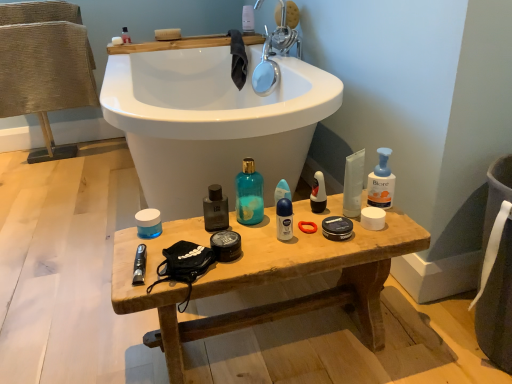
Question: Does teal glass bottle at center, which is the 1th cleaning product from left to right, have a greater width compared to blue matte deodorant stick at center, arranged as the 6th toiletry when viewed from the left?

Choices:
 (A) yes
 (B) no

Answer: (A)

Question: From the image's perspective, is teal glass bottle at center, which is the 1th cleaning product from left to right, below blue matte deodorant stick at center, which is the second toiletry in right-to-left order?

Choices:
 (A) yes
 (B) no

Answer: (B)

Question: Considering the relative positions of teal glass bottle at center, arranged as the third cleaning product when viewed from the right, and blue matte deodorant stick at center, arranged as the 6th toiletry when viewed from the left, in the image provided, is teal glass bottle at center, arranged as the third cleaning product when viewed from the right, to the right of blue matte deodorant stick at center, arranged as the 6th toiletry when viewed from the left, from the viewer's perspective?

Choices:
 (A) yes
 (B) no

Answer: (B)

Question: From the image's perspective, is teal glass bottle at center, arranged as the third cleaning product when viewed from the right, over blue matte deodorant stick at center, which ranks as the fifth toiletry in front-to-back order?

Choices:
 (A) yes
 (B) no

Answer: (A)

Question: Is teal glass bottle at center, which is the 1th cleaning product from left to right, completely or partially outside of blue matte deodorant stick at center, arranged as the third toiletry when viewed from the back?

Choices:
 (A) yes
 (B) no

Answer: (A)

Question: Is the depth of teal glass bottle at center, arranged as the third cleaning product when viewed from the right, less than that of blue matte deodorant stick at center, arranged as the third toiletry when viewed from the back?

Choices:
 (A) yes
 (B) no

Answer: (A)

Question: From the image's perspective, would you say chrome metallic faucet at upper center is positioned over translucent plastic jar at center, which ranks as the seventh toiletry in top-to-bottom order?

Choices:
 (A) no
 (B) yes

Answer: (B)

Question: Is chrome metallic faucet at upper center at the right side of translucent plastic jar at center, placed as the sixth toiletry when sorted from right to left?

Choices:
 (A) no
 (B) yes

Answer: (B)

Question: From the image's perspective, does chrome metallic faucet at upper center appear lower than translucent plastic jar at center, marked as the fifth toiletry in a back-to-front arrangement?

Choices:
 (A) no
 (B) yes

Answer: (A)

Question: Does chrome metallic faucet at upper center have a lesser width compared to translucent plastic jar at center, placed as the sixth toiletry when sorted from right to left?

Choices:
 (A) yes
 (B) no

Answer: (B)

Question: Does chrome metallic faucet at upper center have a greater height compared to translucent plastic jar at center, the 2th toiletry in the left-to-right sequence?

Choices:
 (A) yes
 (B) no

Answer: (A)

Question: Would you say chrome metallic faucet at upper center contains translucent plastic jar at center, which ranks as the seventh toiletry in top-to-bottom order?

Choices:
 (A) no
 (B) yes

Answer: (A)

Question: Is matte plastic toothbrush at upper center, which appears as the 1th toiletry when viewed from the top, in contact with blue matte deodorant stick at center, which ranks as the 4th toiletry in bottom-to-top order?

Choices:
 (A) yes
 (B) no

Answer: (B)